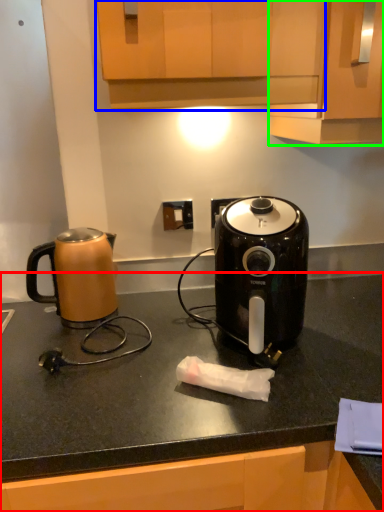
Question: Estimate the real-world distances between objects in this image. Which object is farther from countertop (highlighted by a red box), cabinetry (highlighted by a blue box) or cabinetry (highlighted by a green box)?

Choices:
 (A) cabinetry
 (B) cabinetry

Answer: (A)